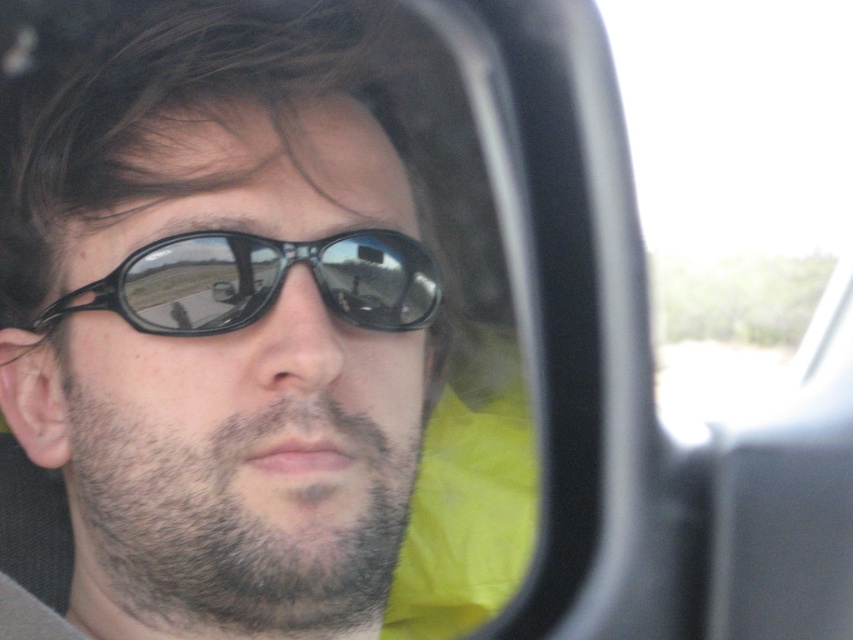
Question: Which is nearer to the matte black sunglasses at center?

Choices:
 (A) transparent glass car window at upper right
 (B) sunglasses at center

Answer: (B)

Question: Is transparent glass car window at upper right above sunglasses at center?

Choices:
 (A) yes
 (B) no

Answer: (A)

Question: Which point is farther to the camera?

Choices:
 (A) transparent glass car window at upper right
 (B) sunglasses at center

Answer: (A)

Question: Which point appears closest to the camera in this image?

Choices:
 (A) (242, 257)
 (B) (697, 272)

Answer: (A)

Question: Can you confirm if matte black sunglasses at center is positioned to the left of transparent glass car window at upper right?

Choices:
 (A) no
 (B) yes

Answer: (B)

Question: Can you confirm if matte black sunglasses at center is positioned above sunglasses at center?

Choices:
 (A) yes
 (B) no

Answer: (B)